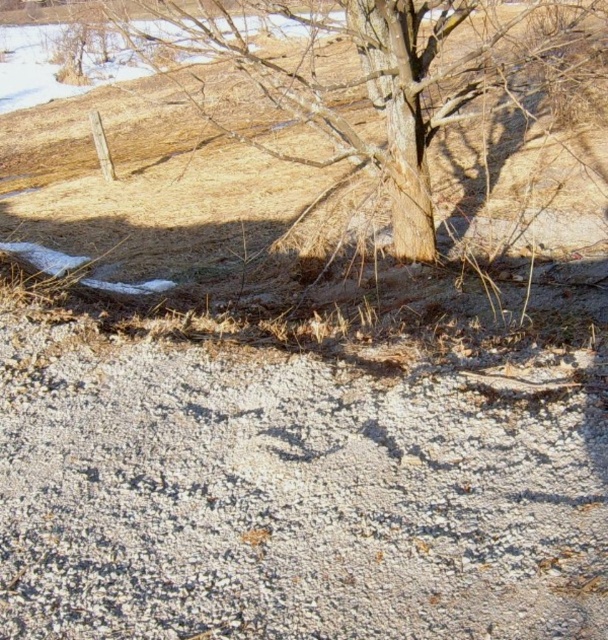
You are a delivery robot with a 2 meter long package. You need to travel from the gray gravelly dirt track at lower center to the brown rough bark tree at center. Is there enough space between them for your package to fit without any part of it extending beyond the path?

The distance between the gray gravelly dirt track at lower center and the brown rough bark tree at center is 7.07 meters. Since your package is only 2 meters long, there is ample space for it to fit comfortably without extending beyond the path.

You are standing at the origin point of the image coordinate system. You need to walk to a specific location. Where should you go to reach the gray gravelly dirt track at lower center?

You should go to the coordinates point at (288, 493) to reach the gray gravelly dirt track at lower center.

You are standing at the point marked by the coordinates point (288, 493). Looking around, what type of terrain are you currently on?

The gray gravelly dirt track at lower center is represented by point (288, 493), so you are standing on a gray gravelly dirt track.